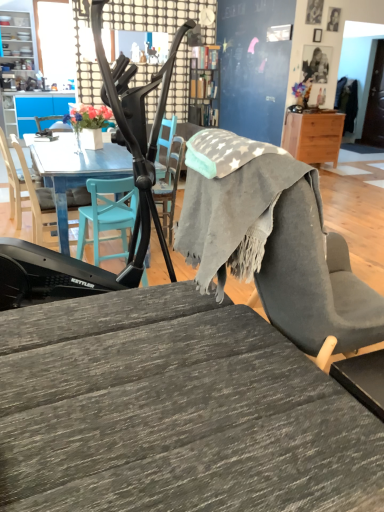
Question: Can you confirm if matte white shelves at upper left is positioned to the right of wooden desk at right, which is counted as the second desk, starting from the left?

Choices:
 (A) no
 (B) yes

Answer: (A)

Question: Considering the relative sizes of matte white shelves at upper left and wooden desk at right, which is counted as the second desk, starting from the left, in the image provided, is matte white shelves at upper left smaller than wooden desk at right, which is counted as the second desk, starting from the left,?

Choices:
 (A) no
 (B) yes

Answer: (A)

Question: From a real-world perspective, is matte white shelves at upper left physically below wooden desk at right, which is counted as the second desk, starting from the front?

Choices:
 (A) no
 (B) yes

Answer: (A)

Question: Is matte white shelves at upper left oriented towards wooden desk at right, which is the second desk from bottom to top?

Choices:
 (A) no
 (B) yes

Answer: (A)

Question: Considering the relative positions of matte white shelves at upper left and wooden desk at right, which is counted as the second desk, starting from the left, in the image provided, is matte white shelves at upper left to the left of wooden desk at right, which is counted as the second desk, starting from the left, from the viewer's perspective?

Choices:
 (A) no
 (B) yes

Answer: (B)

Question: From a real-world perspective, is matte white shelves at upper left located higher than wooden desk at right, which ranks as the 1th desk in right-to-left order?

Choices:
 (A) yes
 (B) no

Answer: (A)

Question: From the image's perspective, is matte black photo frame at upper right, which ranks as the 2th person in top-to-bottom order, over matte black picture frame at upper center, placed as the 1th picture frame when sorted from bottom to top?

Choices:
 (A) no
 (B) yes

Answer: (A)

Question: Considering the relative positions of matte black photo frame at upper right, positioned as the 1th person in bottom-to-top order, and matte black picture frame at upper center, the 2th picture frame positioned from the top, in the image provided, is matte black photo frame at upper right, positioned as the 1th person in bottom-to-top order, in front of matte black picture frame at upper center, the 2th picture frame positioned from the top,?

Choices:
 (A) no
 (B) yes

Answer: (A)

Question: Is matte black photo frame at upper right, which ranks as the 2th person in top-to-bottom order, completely or partially outside of matte black picture frame at upper center, the 2th picture frame positioned from the top?

Choices:
 (A) no
 (B) yes

Answer: (B)

Question: Is matte black photo frame at upper right, positioned as the 1th person in bottom-to-top order, oriented away from matte black picture frame at upper center, which is the first picture frame from back to front?

Choices:
 (A) yes
 (B) no

Answer: (B)

Question: Does matte black photo frame at upper right, which ranks as the 2th person in top-to-bottom order, have a lesser height compared to matte black picture frame at upper center, the 2th picture frame positioned from the top?

Choices:
 (A) yes
 (B) no

Answer: (B)

Question: Does matte black photo frame at upper right, which ranks as the 2th person in top-to-bottom order, have a greater width compared to matte black picture frame at upper center, acting as the second picture frame starting from the front?

Choices:
 (A) no
 (B) yes

Answer: (A)

Question: Is matte black chair at center, the 1th chair when ordered from right to left, at the right side of wooden desk at right, which is counted as the second desk, starting from the front?

Choices:
 (A) yes
 (B) no

Answer: (B)